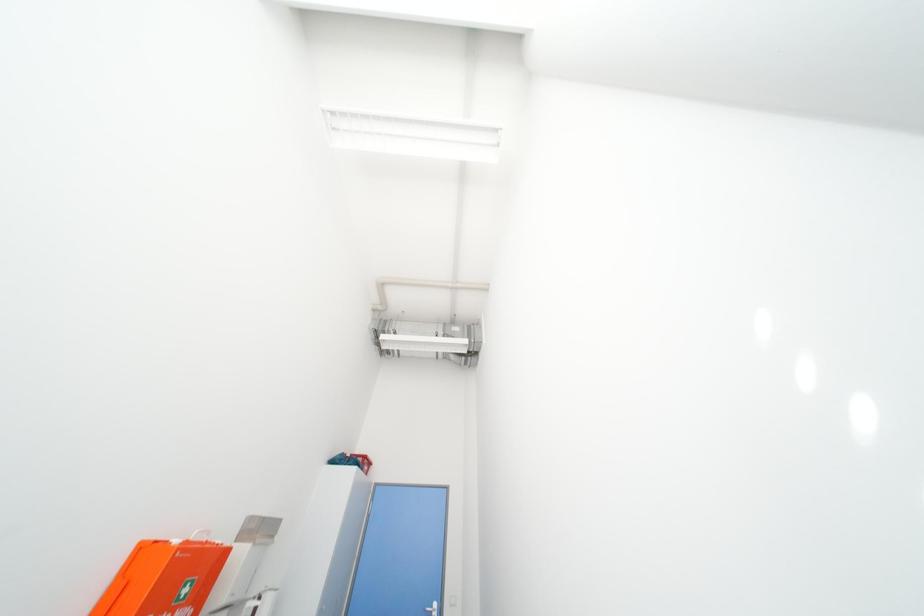
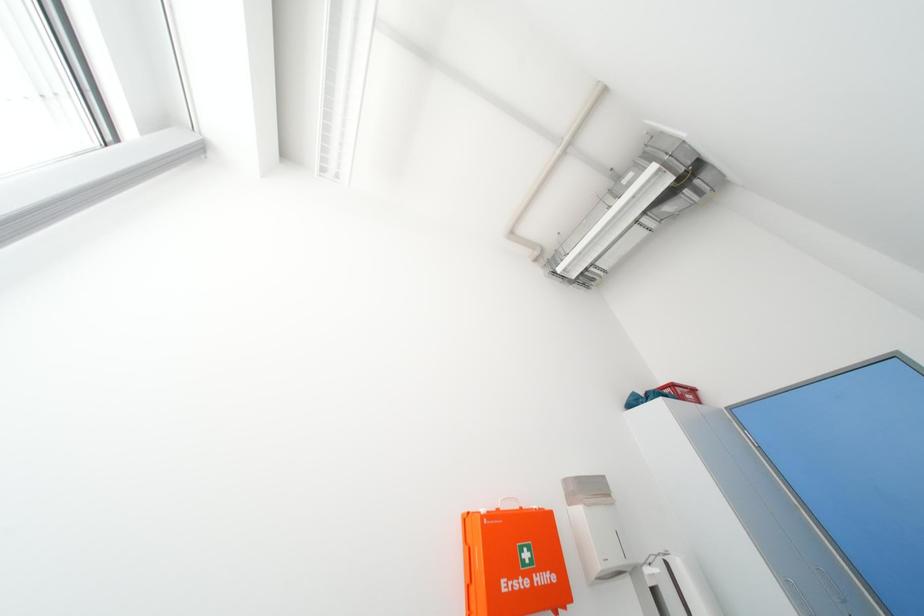
Based on the continuous images, in which direction is the camera rotating?

The camera's rotation is toward left-up.